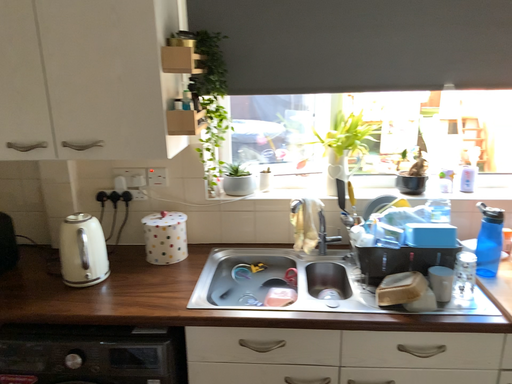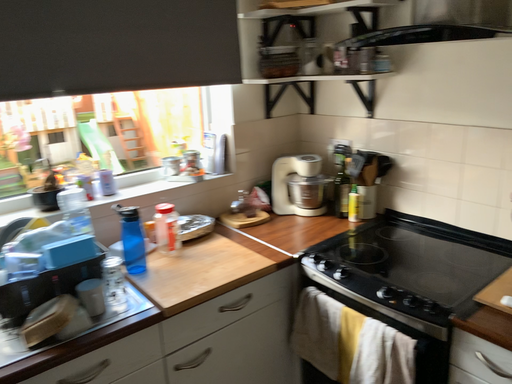
Question: How did the camera likely rotate when shooting the video?

Choices:
 (A) rotated downward
 (B) rotated upward

Answer: (B)